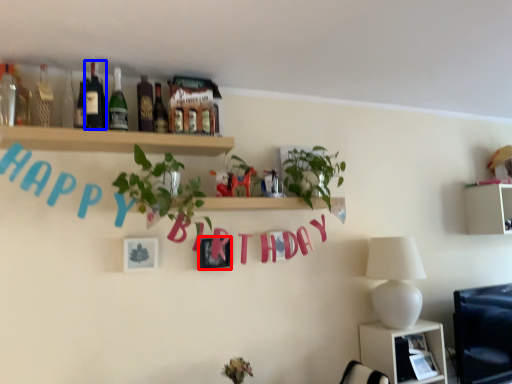
Question: Which point is closer to the camera, picture frame (highlighted by a red box) or bottle (highlighted by a blue box)?

Choices:
 (A) picture frame
 (B) bottle

Answer: (B)